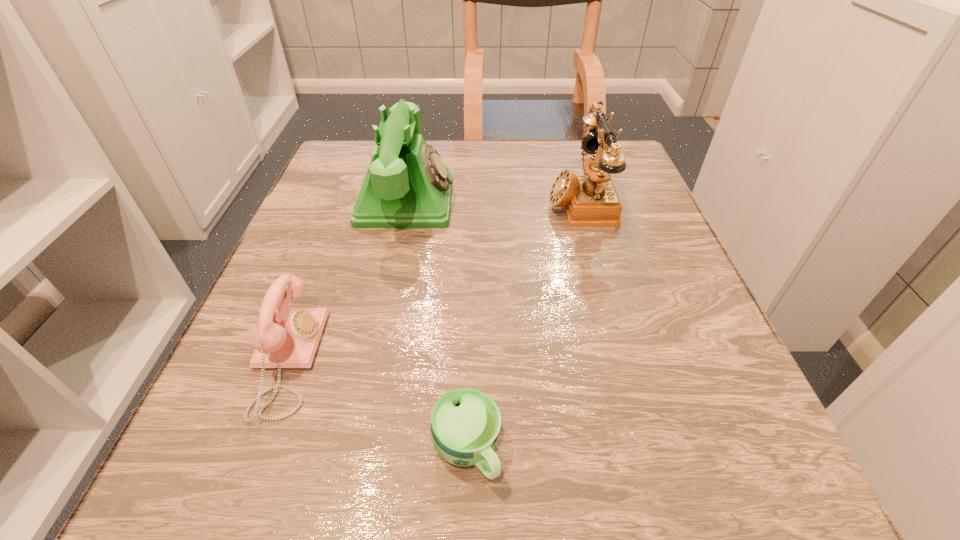
At what (x,y) coordinates should I click in order to perform the action: click on object that is at the right edge. Please return your answer as a coordinate pair (x, y). Looking at the image, I should click on (591, 199).

This screenshot has height=540, width=960. I want to click on object that is at the far left corner, so click(x=407, y=185).

Locate an element on the screen. object positioned at the far right corner is located at coordinates (591, 199).

Find the location of a particular element. This screenshot has width=960, height=540. free space at the far edge of the desktop is located at coordinates (532, 146).

This screenshot has width=960, height=540. In the image, there is a desktop. What are the coordinates of `free space at the near edge` in the screenshot? It's located at (465, 497).

Find the location of a particular element. This screenshot has width=960, height=540. free space at the left edge of the desktop is located at coordinates (260, 425).

In the image, there is a desktop. At what (x,y) coordinates should I click in order to perform the action: click on free space at the right edge. Please return your answer as a coordinate pair (x, y). The width and height of the screenshot is (960, 540). Looking at the image, I should click on (613, 342).

This screenshot has height=540, width=960. What are the coordinates of `free location at the far left corner of the desktop` in the screenshot? It's located at (349, 181).

The image size is (960, 540). Find the location of `free region at the near left corner`. free region at the near left corner is located at coordinates (164, 513).

In the image, there is a desktop. Identify the location of free space at the near right corner. This screenshot has height=540, width=960. (740, 441).